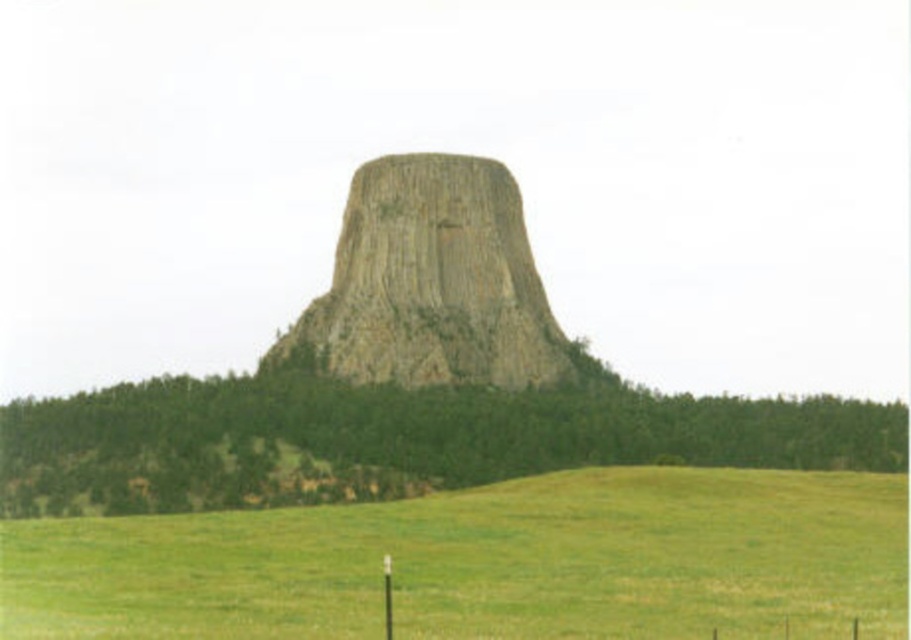
Question: Does green grassy field at lower center appear over green grassy hill at center?

Choices:
 (A) no
 (B) yes

Answer: (A)

Question: Does green grassy hill at center have a smaller size compared to rusty stone rock formation at center?

Choices:
 (A) no
 (B) yes

Answer: (A)

Question: Can you confirm if green grassy field at lower center is positioned to the left of rusty stone rock formation at center?

Choices:
 (A) no
 (B) yes

Answer: (A)

Question: Among these objects, which one is farthest from the camera?

Choices:
 (A) rusty stone rock formation at center
 (B) green grassy field at lower center

Answer: (A)

Question: Which object appears closest to the camera in this image?

Choices:
 (A) rusty stone rock formation at center
 (B) green grassy field at lower center
 (C) green grassy hill at center

Answer: (B)

Question: Based on their relative distances, which object is nearer to the green grassy field at lower center?

Choices:
 (A) green grassy hill at center
 (B) rusty stone rock formation at center

Answer: (A)